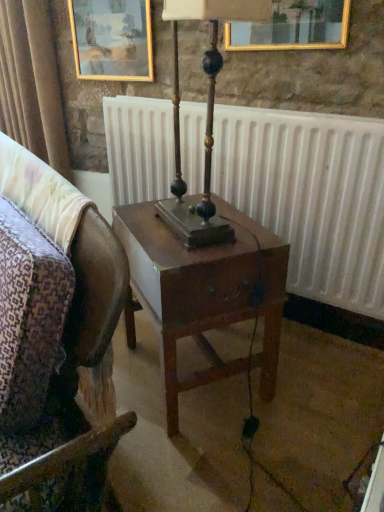
Question: Is velvet curtain at upper left looking in the opposite direction of wooden chair at center?

Choices:
 (A) no
 (B) yes

Answer: (A)

Question: Are velvet curtain at upper left and wooden chair at center located far from each other?

Choices:
 (A) yes
 (B) no

Answer: (A)

Question: Does velvet curtain at upper left have a lesser height compared to wooden chair at center?

Choices:
 (A) yes
 (B) no

Answer: (A)

Question: Considering the relative sizes of velvet curtain at upper left and wooden chair at center in the image provided, is velvet curtain at upper left wider than wooden chair at center?

Choices:
 (A) yes
 (B) no

Answer: (B)

Question: Does velvet curtain at upper left lie behind wooden chair at center?

Choices:
 (A) yes
 (B) no

Answer: (A)

Question: Is point (49, 218) positioned closer to the camera than point (54, 106)?

Choices:
 (A) farther
 (B) closer

Answer: (B)

Question: In the image, is wooden chair at center on the left side or the right side of velvet curtain at upper left?

Choices:
 (A) left
 (B) right

Answer: (B)

Question: Based on their sizes in the image, would you say wooden chair at center is bigger or smaller than velvet curtain at upper left?

Choices:
 (A) big
 (B) small

Answer: (A)

Question: From a real-world perspective, relative to velvet curtain at upper left, is wooden chair at center vertically above or below?

Choices:
 (A) below
 (B) above

Answer: (A)

Question: Is gold-framed painting at upper left in front of or behind white matte radiator at center in the image?

Choices:
 (A) front
 (B) behind

Answer: (B)

Question: From the image's perspective, is gold-framed painting at upper left positioned above or below white matte radiator at center?

Choices:
 (A) above
 (B) below

Answer: (A)

Question: Is gold-framed painting at upper left wider or thinner than white matte radiator at center?

Choices:
 (A) wide
 (B) thin

Answer: (B)

Question: From their relative heights in the image, would you say gold-framed painting at upper left is taller or shorter than white matte radiator at center?

Choices:
 (A) short
 (B) tall

Answer: (A)

Question: From the image's perspective, relative to wooden chair at center, is wooden polished table lamp at center above or below?

Choices:
 (A) below
 (B) above

Answer: (B)

Question: Is wooden polished table lamp at center bigger or smaller than wooden chair at center?

Choices:
 (A) small
 (B) big

Answer: (A)